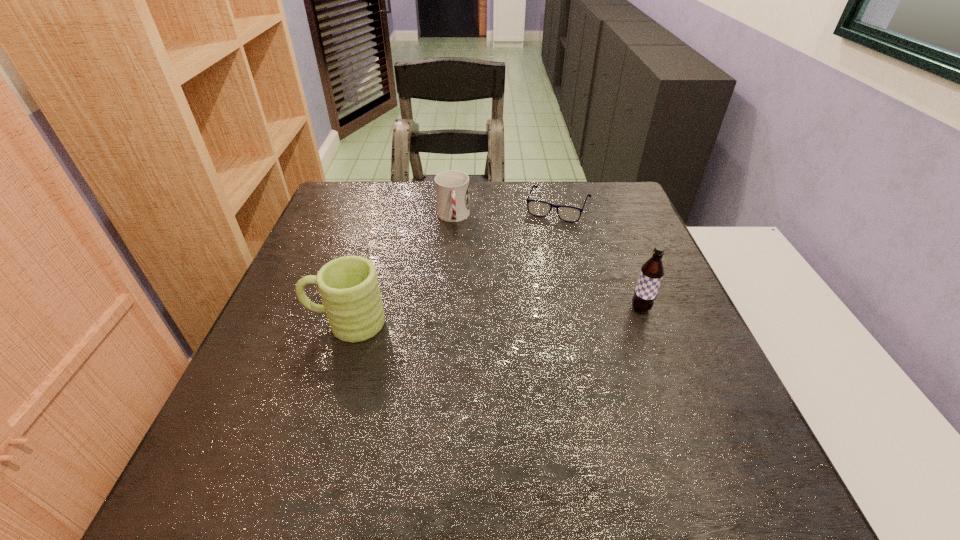
This screenshot has width=960, height=540. In order to click on free spot between the spectacles and the tallest object in this screenshot , I will do `click(600, 258)`.

Find the location of a particular element. Image resolution: width=960 pixels, height=540 pixels. vacant area that lies between the cup and the root beer is located at coordinates (547, 263).

Locate an element on the screen. The width and height of the screenshot is (960, 540). vacant area between the second shortest object and the third shortest object is located at coordinates (399, 270).

Find the location of `free spot between the cup and the shortest object`. free spot between the cup and the shortest object is located at coordinates (506, 212).

Find the location of a particular element. The image size is (960, 540). empty location between the spectacles and the cup is located at coordinates (506, 212).

The height and width of the screenshot is (540, 960). What are the coordinates of `the second closest object to the mug` in the screenshot? It's located at (537, 208).

This screenshot has width=960, height=540. Identify the location of object that is the closest to the second shortest object. (537, 208).